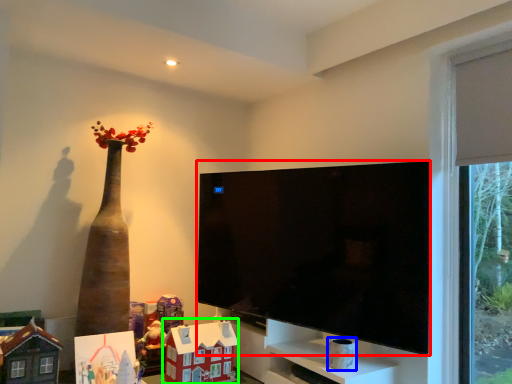
Question: Considering the real-world distances, which object is farthest from television (highlighted by a red box)? toy (highlighted by a blue box) or toy (highlighted by a green box)?

Choices:
 (A) toy
 (B) toy

Answer: (A)